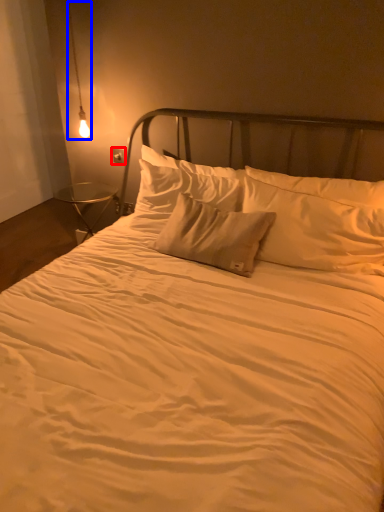
Question: Which object appears farthest to the camera in this image, electric outlet (highlighted by a red box) or lamp (highlighted by a blue box)?

Choices:
 (A) electric outlet
 (B) lamp

Answer: (A)